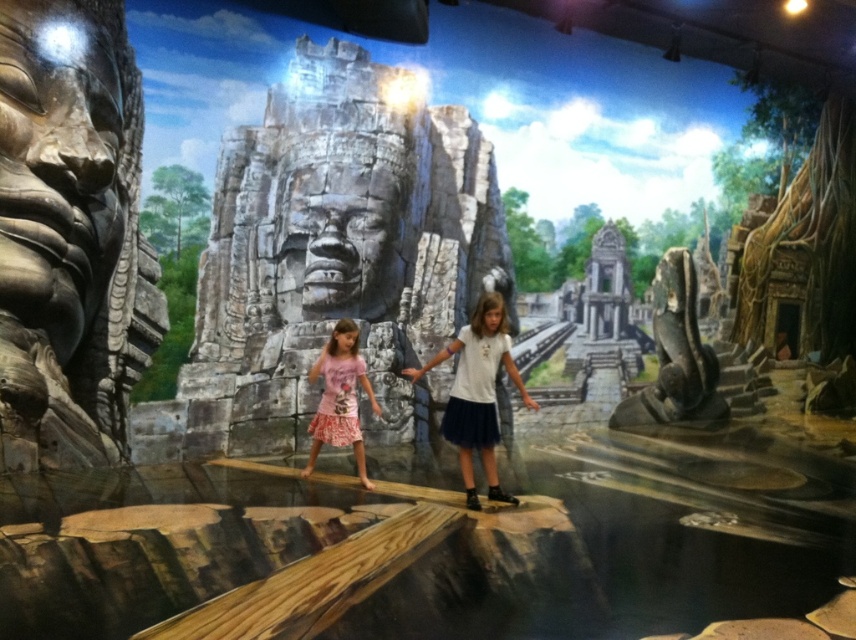
You are a photographer planning to take a picture of the two girls in the temple exhibit. The girls are wearing the white tulle skirt at center and the pink floral dress at center. Based on their positions, which girl should you focus on first to ensure both are in frame?

The white tulle skirt at center is located above the pink floral dress at center, so you should focus on the girl wearing the white tulle skirt at center first as she is positioned higher and more central, ensuring both are captured in the frame.